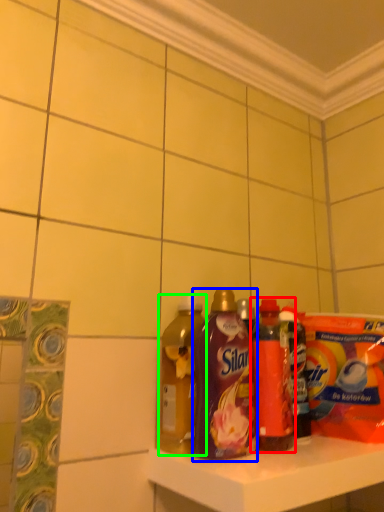
Question: Which object is positioned closest to bottle (highlighted by a red box)? Select from bottle (highlighted by a blue box) and bottle (highlighted by a green box).

Choices:
 (A) bottle
 (B) bottle

Answer: (A)